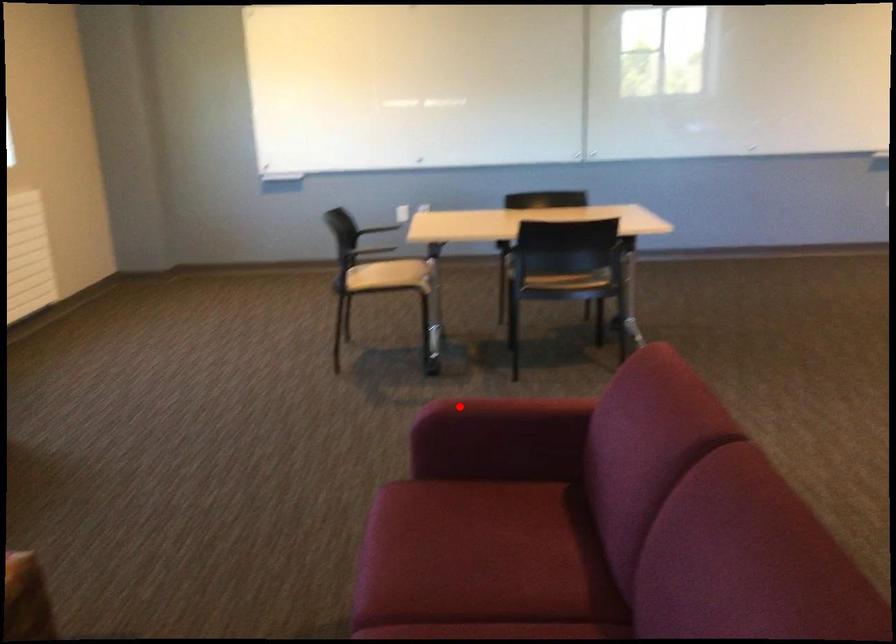
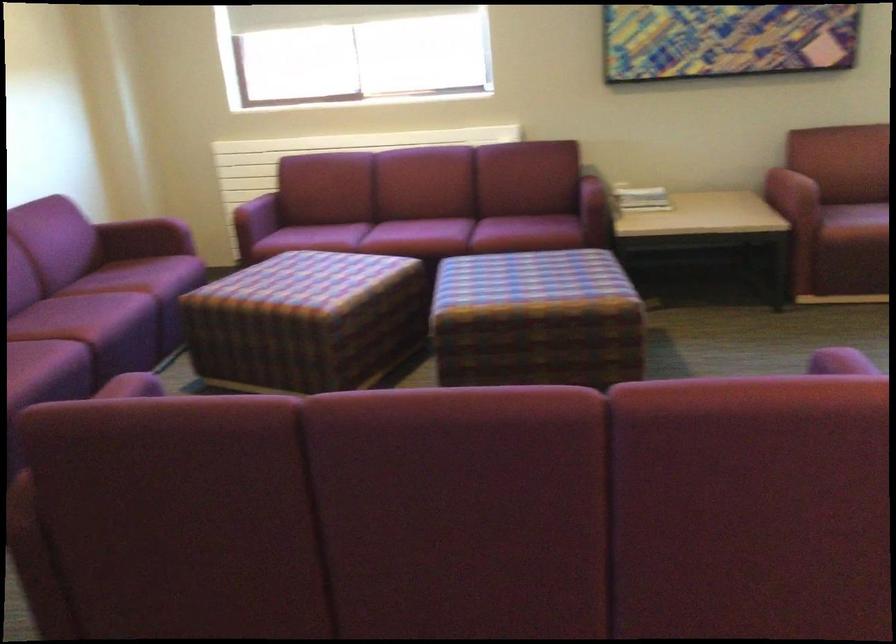
Where in the second image is the point corresponding to the highlighted location from the first image?

(840, 362)